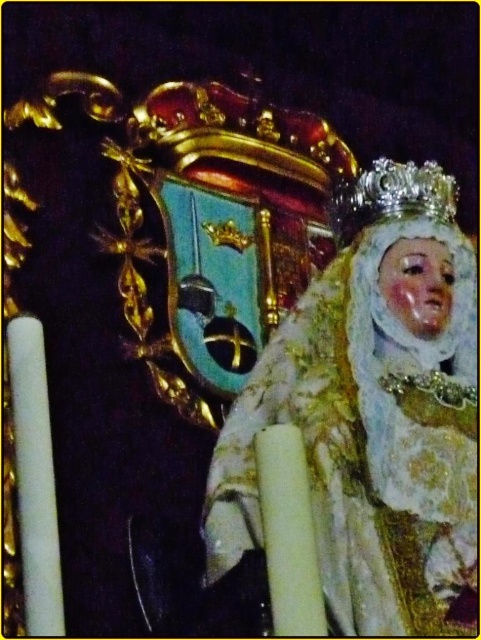
Question: Is porcelain statue at center to the right of silver/golden metallic crown at upper center from the viewer's perspective?

Choices:
 (A) no
 (B) yes

Answer: (A)

Question: Which object is closer to the camera taking this photo?

Choices:
 (A) porcelain statue at center
 (B) silver/golden metallic crown at upper center

Answer: (A)

Question: Where is porcelain statue at center located in relation to silver/golden metallic crown at upper center in the image?

Choices:
 (A) left
 (B) right

Answer: (A)

Question: Which point appears farthest from the camera in this image?

Choices:
 (A) (354, 196)
 (B) (212, 518)

Answer: (A)

Question: Can you confirm if porcelain statue at center is positioned below silver/golden metallic crown at upper center?

Choices:
 (A) yes
 (B) no

Answer: (A)